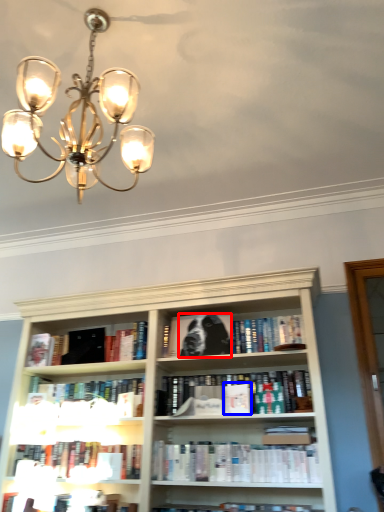
Question: Which of the following is the farthest to the observer, dog (highlighted by a red box) or paperback book (highlighted by a blue box)?

Choices:
 (A) dog
 (B) paperback book

Answer: (A)